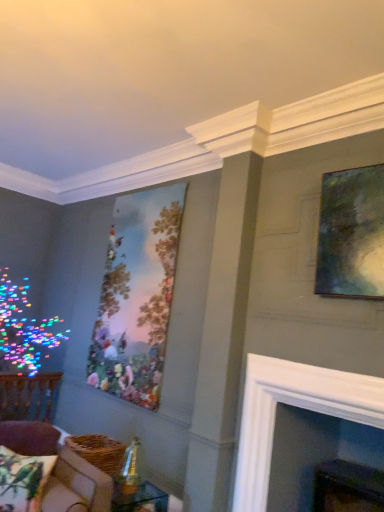
Question: Is velvet brown couch at lower left to the left of metallic green painting at upper right, which is the 1th picture frame from front to back, from the viewer's perspective?

Choices:
 (A) yes
 (B) no

Answer: (A)

Question: Is velvet brown couch at lower left closer to camera compared to metallic green painting at upper right, which is the 1th picture frame from front to back?

Choices:
 (A) yes
 (B) no

Answer: (A)

Question: Is velvet brown couch at lower left wider than metallic green painting at upper right, which is the 1th picture frame from front to back?

Choices:
 (A) no
 (B) yes

Answer: (B)

Question: From a real-world perspective, is velvet brown couch at lower left on top of metallic green painting at upper right, which ranks as the 2th picture frame in back-to-front order?

Choices:
 (A) no
 (B) yes

Answer: (A)

Question: Is velvet brown couch at lower left next to metallic green painting at upper right, which is the first picture frame in right-to-left order, and touching it?

Choices:
 (A) no
 (B) yes

Answer: (A)

Question: From the image's perspective, relative to clear glass table at lower center, is matte canvas painting at center-left, positioned as the second picture frame in right-to-left order, above or below?

Choices:
 (A) above
 (B) below

Answer: (A)

Question: Is matte canvas painting at center-left, the first picture frame positioned from the back, to the left or to the right of clear glass table at lower center in the image?

Choices:
 (A) left
 (B) right

Answer: (A)

Question: Considering the positions of matte canvas painting at center-left, the first picture frame positioned from the back, and clear glass table at lower center in the image, is matte canvas painting at center-left, the first picture frame positioned from the back, bigger or smaller than clear glass table at lower center?

Choices:
 (A) small
 (B) big

Answer: (B)

Question: From a real-world perspective, is matte canvas painting at center-left, the first picture frame positioned from the back, physically located above or below clear glass table at lower center?

Choices:
 (A) above
 (B) below

Answer: (A)

Question: Is velvet brown couch at lower left inside the boundaries of metallic green painting at upper right, marked as the 2th picture frame in a left-to-right arrangement, or outside?

Choices:
 (A) inside
 (B) outside

Answer: (B)

Question: From a real-world perspective, is velvet brown couch at lower left positioned above or below metallic green painting at upper right, which ranks as the 2th picture frame in back-to-front order?

Choices:
 (A) above
 (B) below

Answer: (B)

Question: Considering the positions of velvet brown couch at lower left and metallic green painting at upper right, which ranks as the 2th picture frame in back-to-front order, in the image, is velvet brown couch at lower left bigger or smaller than metallic green painting at upper right, which ranks as the 2th picture frame in back-to-front order,?

Choices:
 (A) small
 (B) big

Answer: (B)

Question: From the image's perspective, is velvet brown couch at lower left located above or below metallic green painting at upper right, marked as the 2th picture frame in a left-to-right arrangement?

Choices:
 (A) below
 (B) above

Answer: (A)

Question: From a real-world perspective, is white glossy fireplace at center above or below printed fabric pillow with parrots at lower left?

Choices:
 (A) above
 (B) below

Answer: (A)

Question: In the image, is white glossy fireplace at center positioned in front of or behind printed fabric pillow with parrots at lower left?

Choices:
 (A) behind
 (B) front

Answer: (B)